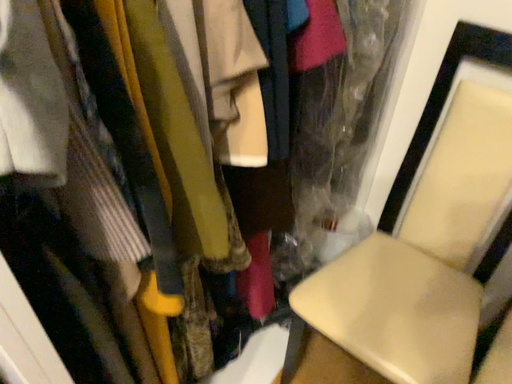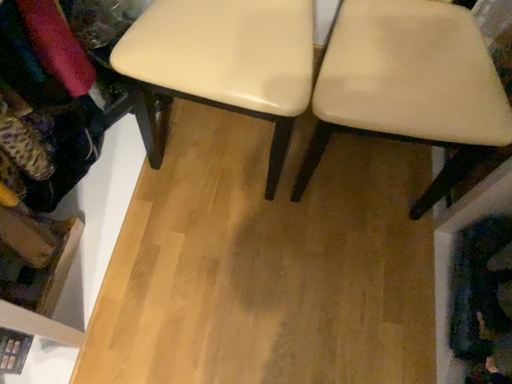
Question: Which way did the camera rotate in the video?

Choices:
 (A) rotated left
 (B) rotated right

Answer: (B)